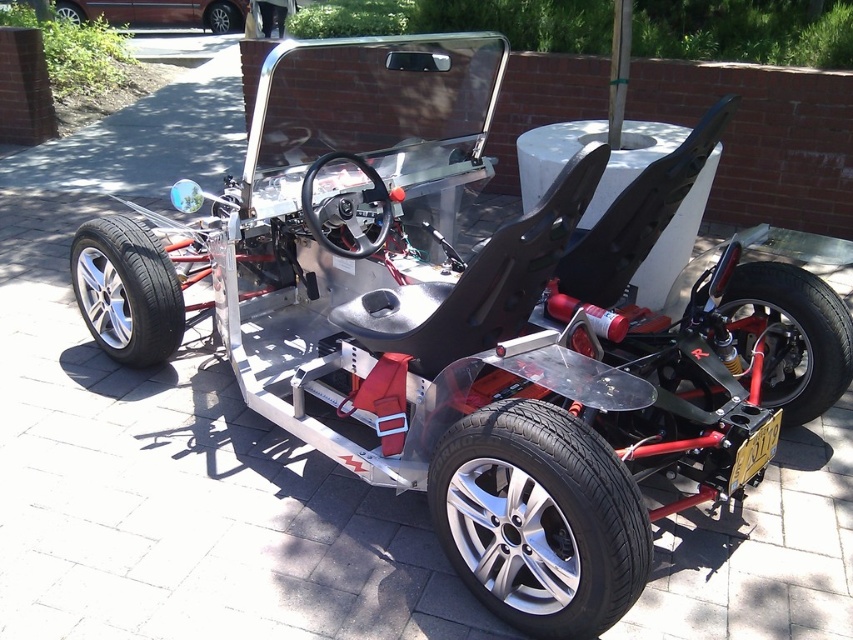
Question: Among these objects, which one is nearest to the camera?

Choices:
 (A) black rubber tire at lower right
 (B) silver metallic wheel at left
 (C) silver metallic wheel at center

Answer: (A)

Question: Is shiny silver rim at left positioned behind silver metallic wheel at left?

Choices:
 (A) no
 (B) yes

Answer: (A)

Question: Is black rubber tire at lower right positioned at the back of shiny silver rim at left?

Choices:
 (A) yes
 (B) no

Answer: (B)

Question: Which object is closer to the camera taking this photo?

Choices:
 (A) black rubber tire at lower right
 (B) silver metallic wheel at center

Answer: (A)

Question: Is shiny silver rim at left thinner than metallic maroon van at upper left?

Choices:
 (A) no
 (B) yes

Answer: (B)

Question: Which point is farther to the camera?

Choices:
 (A) (699, 298)
 (B) (135, 4)
 (C) (233, 28)
 (D) (509, 438)

Answer: (C)